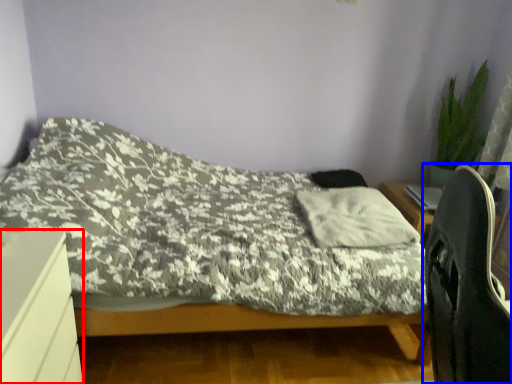
Question: Which object is further to the camera taking this photo, desk (highlighted by a red box) or computer chair (highlighted by a blue box)?

Choices:
 (A) desk
 (B) computer chair

Answer: (A)